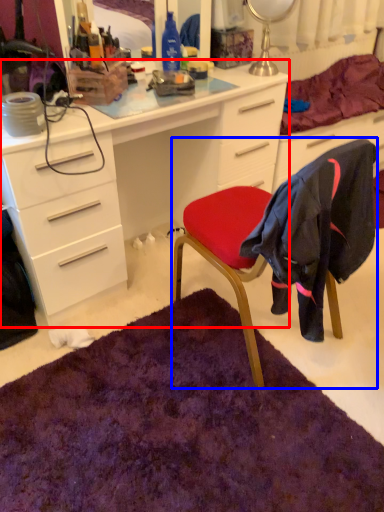
Question: Which object is further to the camera taking this photo, desk (highlighted by a red box) or chair (highlighted by a blue box)?

Choices:
 (A) desk
 (B) chair

Answer: (A)